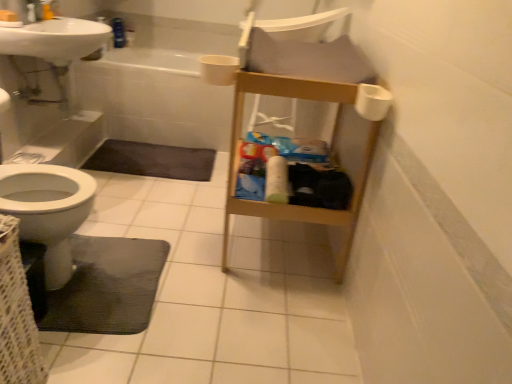
Where is `vacant area located to the right-hand side of black rubber bath mat at lower left, which is the 1th bath mat in front-to-back order`? vacant area located to the right-hand side of black rubber bath mat at lower left, which is the 1th bath mat in front-to-back order is located at coordinates pyautogui.click(x=218, y=290).